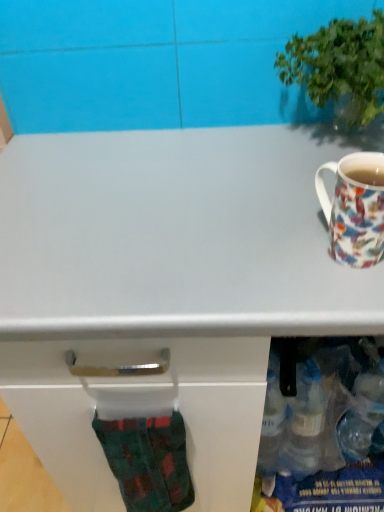
The height and width of the screenshot is (512, 384). Identify the location of vacant space in green leafy plant at upper right (from a real-world perspective). (323, 147).